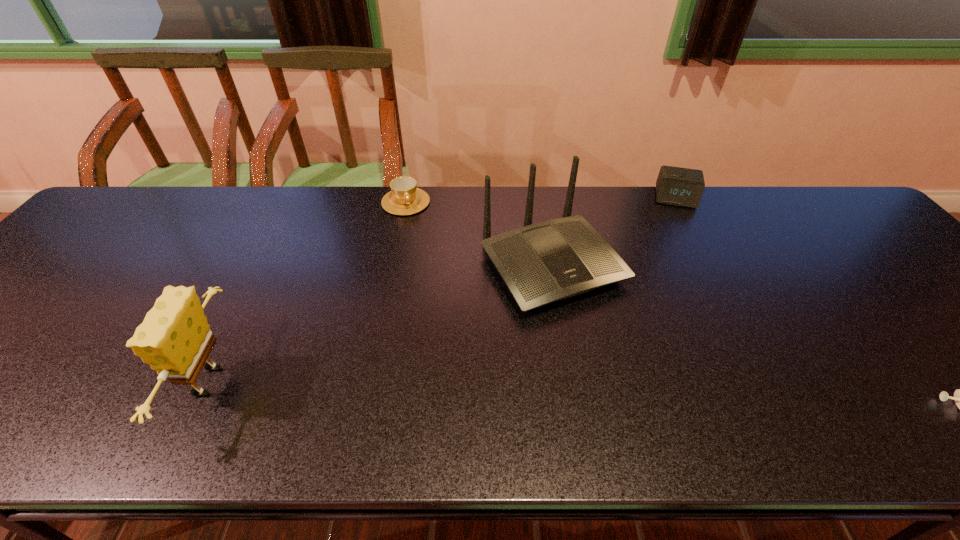
You are a GUI agent. You are given a task and a screenshot of the screen. Output one action in this format:
    pyautogui.click(x=<x>, y=<y>)
    Task: Click on the vacant region located 0.170m with the handle on the side of the cup
    This screenshot has width=960, height=540.
    Given the screenshot: What is the action you would take?
    425,252

Find the location of a particular element. Image resolution: width=960 pixels, height=540 pixels. free region located 0.200m with the handle on the side of the cup is located at coordinates (428, 259).

Identify the location of free region located 0.070m with the handle on the side of the cup. (417, 230).

Find the location of a particular element. Image resolution: width=960 pixels, height=540 pixels. vacant space located on the front-facing side of the router is located at coordinates (604, 332).

You are a GUI agent. You are given a task and a screenshot of the screen. Output one action in this format:
    pyautogui.click(x=<x>, y=<y>)
    Task: Click on the free space located 0.140m on the front-facing side of the router
    Image resolution: width=960 pixels, height=540 pixels.
    Given the screenshot: What is the action you would take?
    pyautogui.click(x=628, y=363)

Locate an element on the screen. The height and width of the screenshot is (540, 960). free point located on the front-facing side of the alarm clock is located at coordinates (681, 272).

This screenshot has width=960, height=540. Find the location of `vacant space located on the front-facing side of the alarm clock`. vacant space located on the front-facing side of the alarm clock is located at coordinates (683, 291).

Where is `blank space located 0.080m on the front-facing side of the alarm clock`? blank space located 0.080m on the front-facing side of the alarm clock is located at coordinates (677, 225).

Find the location of a particular element. cup positioned at the far edge is located at coordinates (405, 198).

The width and height of the screenshot is (960, 540). I want to click on router located at the far edge, so click(541, 263).